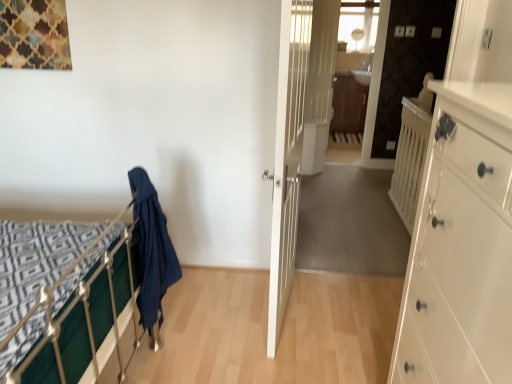
Identify the location of free spot to the left of white wooden balustrade at right. The image size is (512, 384). (350, 215).